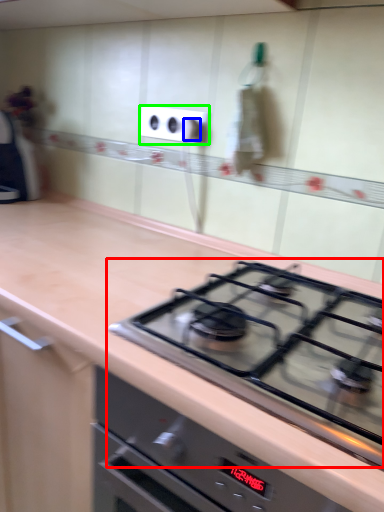
Question: Estimate the real-world distances between objects in this image. Which object is closer to gas stove (highlighted by a red box), knob (highlighted by a blue box) or electric outlet (highlighted by a green box)?

Choices:
 (A) knob
 (B) electric outlet

Answer: (B)